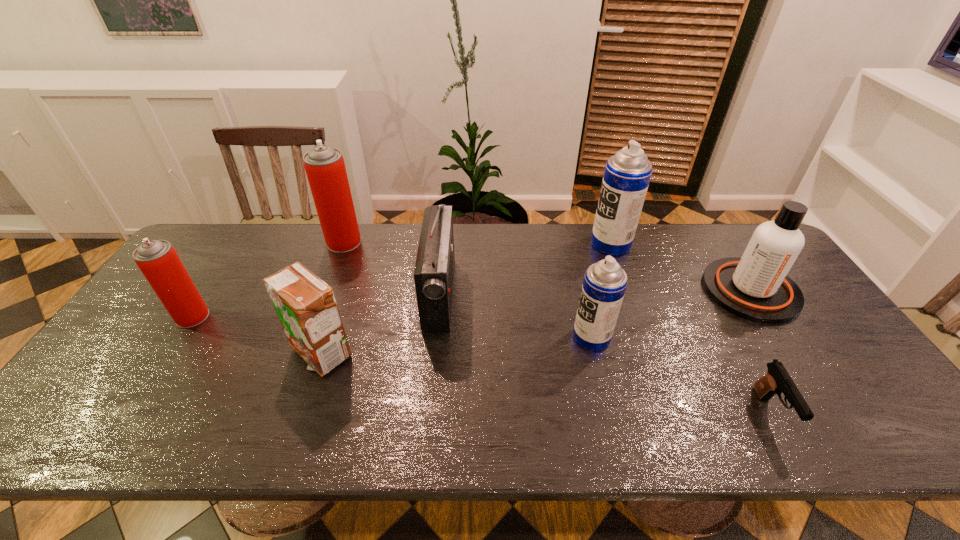
Where is `vacant area at the far edge of the desktop`? This screenshot has width=960, height=540. vacant area at the far edge of the desktop is located at coordinates (355, 254).

Locate an element on the screen. vacant space at the near edge of the desktop is located at coordinates (715, 448).

Find the location of a particular element. The image size is (960, 540). free spot at the right edge of the desktop is located at coordinates (781, 332).

You are a GUI agent. You are given a task and a screenshot of the screen. Output one action in this format:
    pyautogui.click(x=<x>, y=<y>)
    Task: Click on the blank area at the far left corner
    
    Given the screenshot: What is the action you would take?
    pyautogui.click(x=238, y=232)

The height and width of the screenshot is (540, 960). In the image, there is a desktop. In order to click on vacant area at the near left corner in this screenshot , I will do `click(130, 417)`.

Identify the location of free space that is in between the left blue aerosol can and the leftmost aerosol can. (392, 327).

Locate an element on the screen. empty location between the smaller blue aerosol can and the black pistol is located at coordinates (681, 375).

Image resolution: width=960 pixels, height=540 pixels. I want to click on free spot between the fourth object from left to right and the nearer blue aerosol can, so 516,315.

This screenshot has height=540, width=960. Find the location of `vacant region between the right blue aerosol can and the shortest object`. vacant region between the right blue aerosol can and the shortest object is located at coordinates (690, 328).

This screenshot has width=960, height=540. I want to click on vacant point located between the third aerosol can from right to left and the white cleansing agent, so click(547, 266).